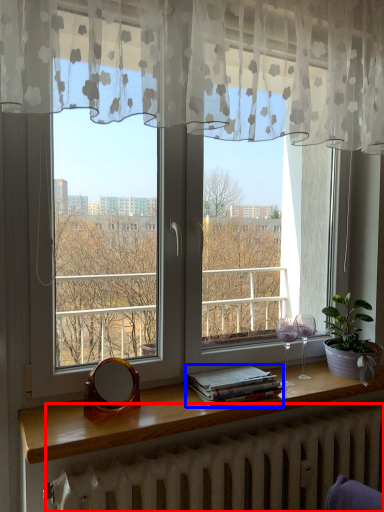
Question: Which object is further to the camera taking this photo, radiator (highlighted by a red box) or book (highlighted by a blue box)?

Choices:
 (A) radiator
 (B) book

Answer: (B)